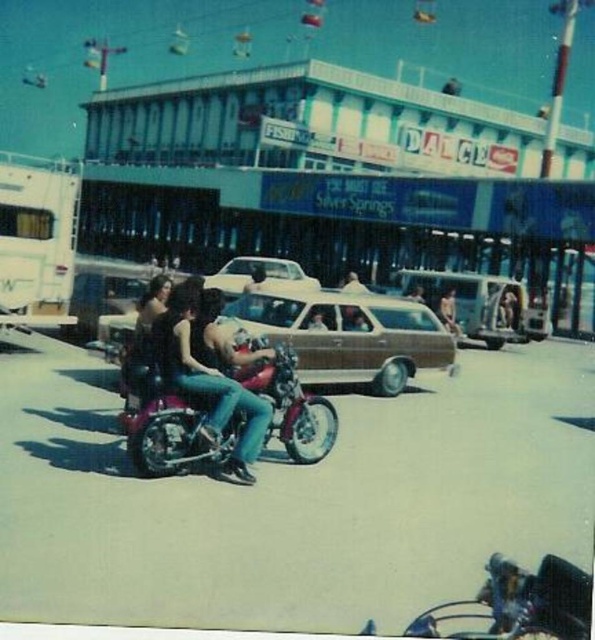
Question: Is shiny chrome motorcycle at center wider than denim jeans at center?

Choices:
 (A) no
 (B) yes

Answer: (B)

Question: Which object is positioned closest to the brown matte station wagon at center?

Choices:
 (A) white matte sedan at center
 (B) shiny chrome motorcycle at center
 (C) shiny chrome motorcycle at lower right
 (D) denim jeans at center

Answer: (B)

Question: Can you confirm if brown matte station wagon at center is positioned to the right of shiny chrome motorcycle at lower right?

Choices:
 (A) yes
 (B) no

Answer: (A)

Question: Which of the following is the farthest from the observer?

Choices:
 (A) (242, 422)
 (B) (158, 337)
 (C) (422, 612)

Answer: (A)

Question: Which of these objects is positioned closest to the shiny chrome motorcycle at lower right?

Choices:
 (A) denim jeans at center
 (B) brown matte station wagon at center

Answer: (A)

Question: Is shiny chrome motorcycle at lower right above white matte sedan at center?

Choices:
 (A) yes
 (B) no

Answer: (B)